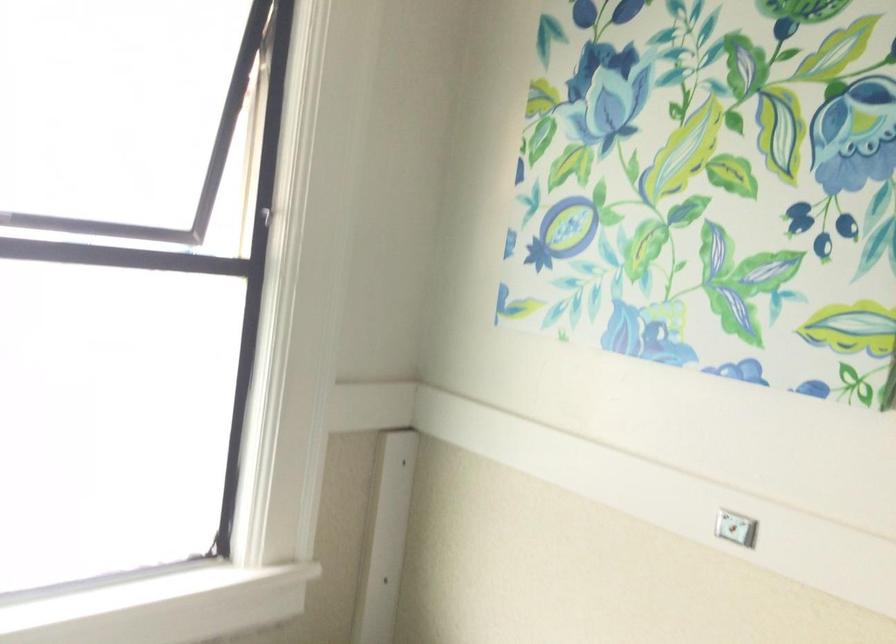
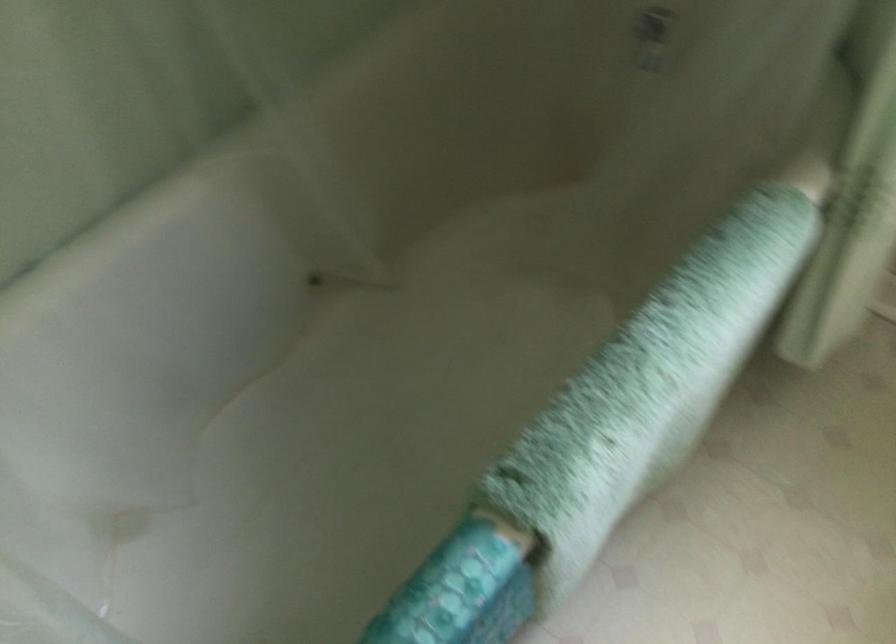
Consider the image. How did the camera likely rotate?

The camera's rotation is toward left-down.